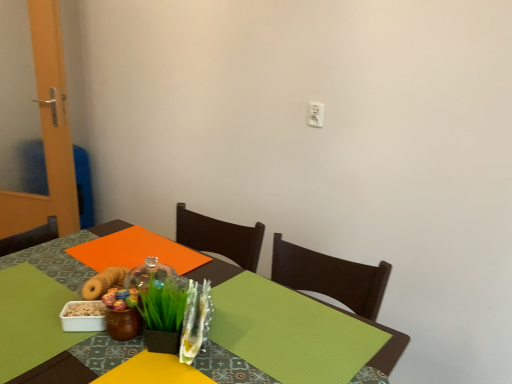
Question: Can you confirm if white plastic electric outlet at upper center is wider than green leafy grass at center?

Choices:
 (A) yes
 (B) no

Answer: (B)

Question: Is white plastic electric outlet at upper center to the left of green leafy grass at center from the viewer's perspective?

Choices:
 (A) no
 (B) yes

Answer: (A)

Question: Can you confirm if white plastic electric outlet at upper center is shorter than green leafy grass at center?

Choices:
 (A) yes
 (B) no

Answer: (A)

Question: Is green leafy grass at center a part of white plastic electric outlet at upper center?

Choices:
 (A) no
 (B) yes

Answer: (A)

Question: Does white plastic electric outlet at upper center have a smaller size compared to green leafy grass at center?

Choices:
 (A) yes
 (B) no

Answer: (A)

Question: From the image's perspective, is green fabric table at center positioned above or below white plastic electric outlet at upper center?

Choices:
 (A) above
 (B) below

Answer: (B)

Question: Looking at their shapes, would you say green fabric table at center is wider or thinner than white plastic electric outlet at upper center?

Choices:
 (A) wide
 (B) thin

Answer: (A)

Question: Is green fabric table at center bigger or smaller than white plastic electric outlet at upper center?

Choices:
 (A) small
 (B) big

Answer: (B)

Question: Is green fabric table at center to the left or to the right of white plastic electric outlet at upper center in the image?

Choices:
 (A) right
 (B) left

Answer: (B)

Question: From the image's perspective, is green leafy grass at center above or below green fabric table at center?

Choices:
 (A) above
 (B) below

Answer: (A)

Question: Is point (161, 329) positioned closer to the camera than point (384, 345)?

Choices:
 (A) farther
 (B) closer

Answer: (B)

Question: Based on their positions, is green leafy grass at center located to the left or right of green fabric table at center?

Choices:
 (A) right
 (B) left

Answer: (A)

Question: In terms of height, does green leafy grass at center look taller or shorter compared to green fabric table at center?

Choices:
 (A) short
 (B) tall

Answer: (A)

Question: From a real-world perspective, is white plastic electric outlet at upper center above or below green leafy grass at center?

Choices:
 (A) above
 (B) below

Answer: (A)

Question: Considering the relative positions of white plastic electric outlet at upper center and green leafy grass at center in the image provided, is white plastic electric outlet at upper center to the left or to the right of green leafy grass at center?

Choices:
 (A) left
 (B) right

Answer: (B)